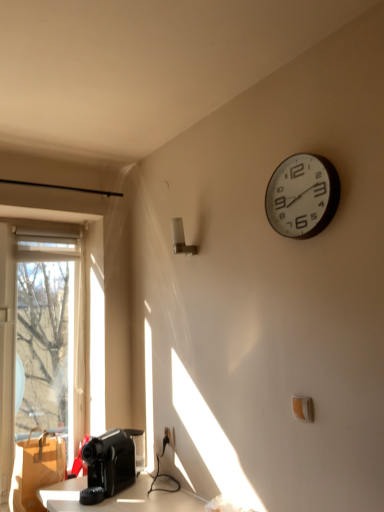
Question: Considering the positions of black plastic coffee machine at lower left and brown cardboard box at lower left in the image, is black plastic coffee machine at lower left bigger or smaller than brown cardboard box at lower left?

Choices:
 (A) big
 (B) small

Answer: (B)

Question: Is black plastic coffee machine at lower left taller or shorter than brown cardboard box at lower left?

Choices:
 (A) tall
 (B) short

Answer: (B)

Question: Considering the real-world distances, which object is farthest from the white plastic wall clock at upper right?

Choices:
 (A) brown cardboard box at lower left
 (B) black plastic coffee machine at lower left

Answer: (A)

Question: Which object is positioned farthest from the white plastic wall clock at upper right?

Choices:
 (A) black plastic coffee machine at lower left
 (B) brown cardboard box at lower left

Answer: (B)